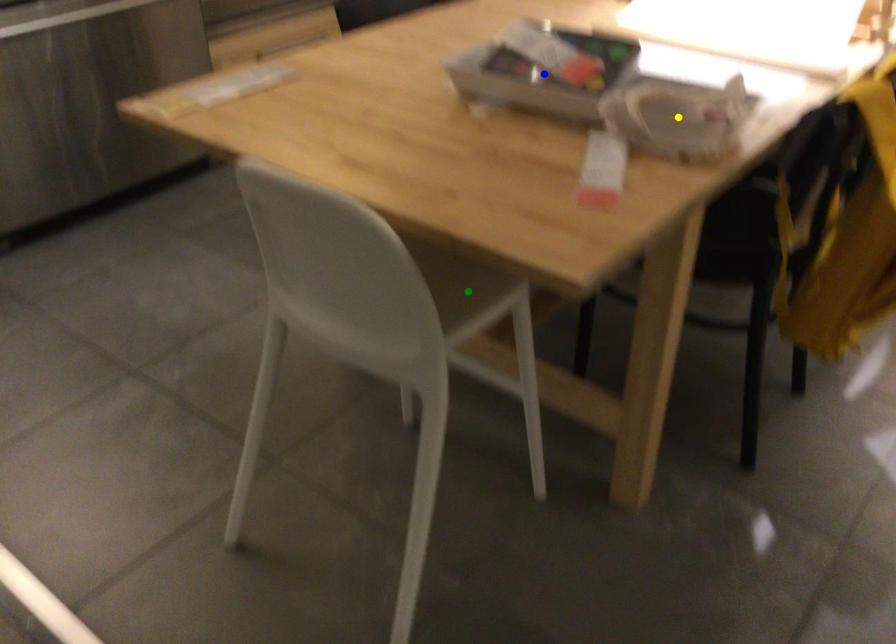
Order these from nearest to farthest:
green point
yellow point
blue point

1. yellow point
2. green point
3. blue point